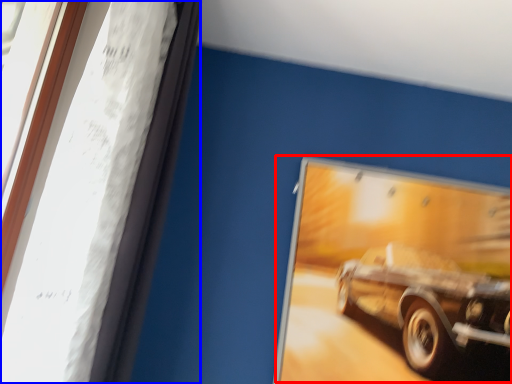
Question: Which of the following is the farthest to the observer, car (highlighted by a red box) or window frame (highlighted by a blue box)?

Choices:
 (A) car
 (B) window frame

Answer: (A)